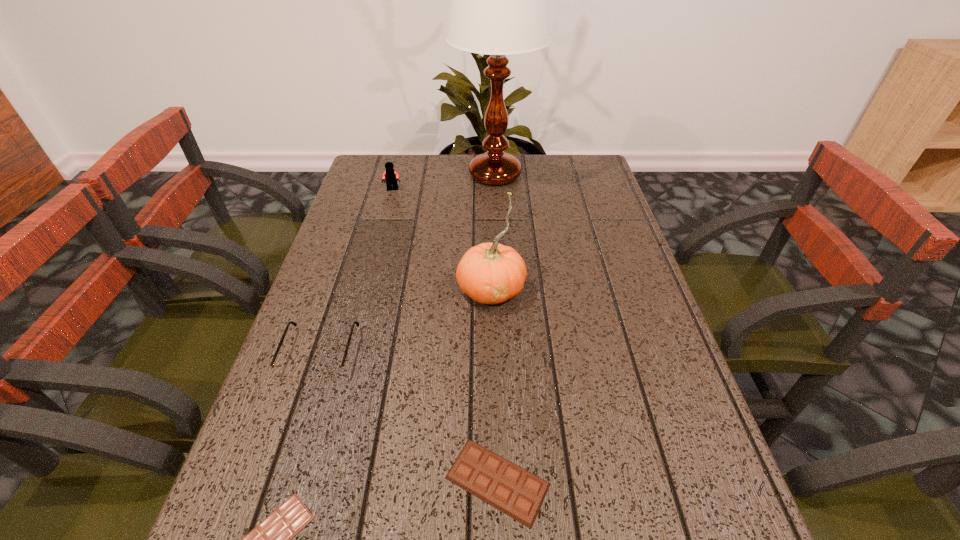
Find the location of a particular element. This screenshot has height=540, width=960. table lamp is located at coordinates (499, 0).

This screenshot has width=960, height=540. Identify the location of the third farthest object. pyautogui.click(x=490, y=273).

This screenshot has height=540, width=960. Identify the location of pumpkin. (490, 273).

Locate an element on the screen. Image resolution: width=960 pixels, height=540 pixels. Lego is located at coordinates (390, 176).

This screenshot has width=960, height=540. Find the location of `spectacles`. spectacles is located at coordinates (286, 371).

Locate an element on the screen. The height and width of the screenshot is (540, 960). the fourth tallest object is located at coordinates (286, 371).

The width and height of the screenshot is (960, 540). I want to click on the fifth tallest object, so click(x=518, y=493).

Where is `the right chocolate bar`? the right chocolate bar is located at coordinates (518, 493).

Locate an element on the screen. free space located 0.070m on the front of the table lamp is located at coordinates (496, 211).

In order to click on vacant space located on the front of the third farthest object in this screenshot , I will do `click(493, 375)`.